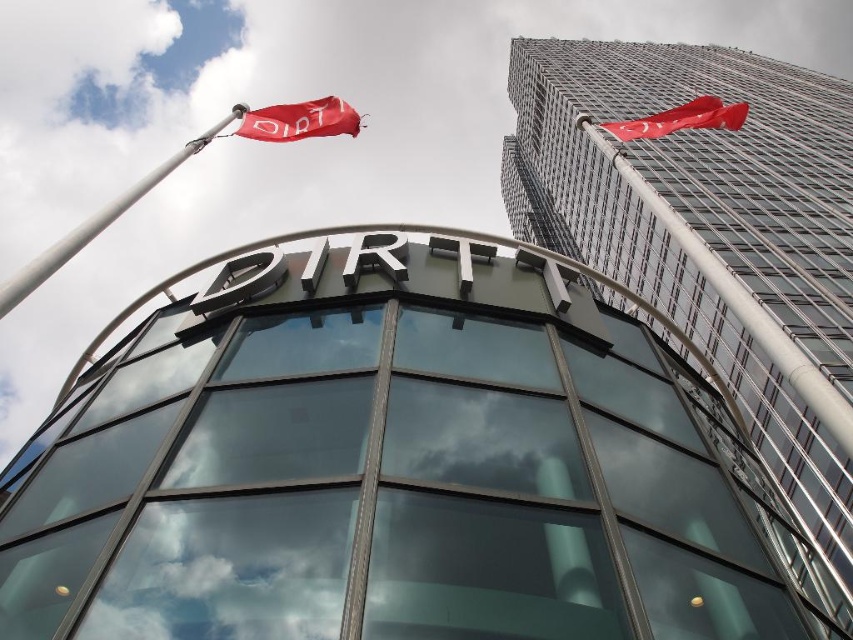
Can you confirm if silver metallic flag pole at upper left is taller than red fabric flag at upper left?

Yes.

What do you see at coordinates (97, 221) in the screenshot?
I see `silver metallic flag pole at upper left` at bounding box center [97, 221].

The image size is (853, 640). I want to click on silver metallic flag pole at upper left, so click(97, 221).

Between silver metallic flag pole at upper left and red fabric flag at upper right, which one is positioned higher?

red fabric flag at upper right is higher up.

The width and height of the screenshot is (853, 640). What do you see at coordinates (97, 221) in the screenshot?
I see `silver metallic flag pole at upper left` at bounding box center [97, 221].

The width and height of the screenshot is (853, 640). What are the coordinates of `silver metallic flag pole at upper left` in the screenshot? It's located at (97, 221).

Which is below, red fabric flag at upper left or red fabric flag at upper right?

red fabric flag at upper left is lower down.

Which is above, red fabric flag at upper left or red fabric flag at upper right?

red fabric flag at upper right is above.

Is point (260, 131) behind point (718, 100)?

Yes, point (260, 131) is farther from viewer.

The height and width of the screenshot is (640, 853). Find the location of `red fabric flag at upper left`. red fabric flag at upper left is located at coordinates (299, 120).